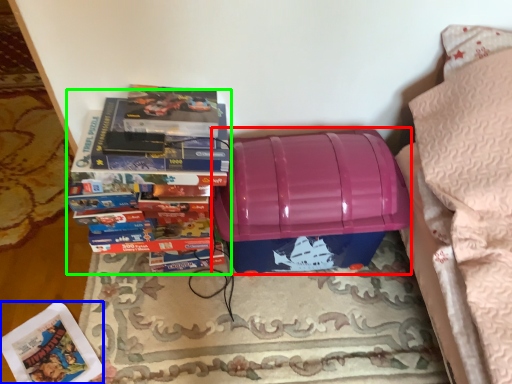
Question: Which object is positioned farthest from storage box (highlighted by a red box)? Select from paperback book (highlighted by a blue box) and book (highlighted by a green box).

Choices:
 (A) paperback book
 (B) book

Answer: (A)